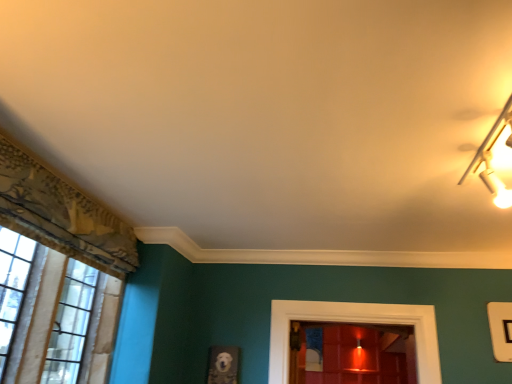
Question: From a real-world perspective, is white textured curtain at left physically located above or below metallic gold light fixture at upper right?

Choices:
 (A) above
 (B) below

Answer: (B)

Question: From the image's perspective, is white textured curtain at left located above or below metallic gold light fixture at upper right?

Choices:
 (A) above
 (B) below

Answer: (B)

Question: Looking at the image, does white textured curtain at left seem bigger or smaller compared to metallic gold light fixture at upper right?

Choices:
 (A) big
 (B) small

Answer: (A)

Question: Considering the positions of metallic gold light fixture at upper right and white textured curtain at left in the image, is metallic gold light fixture at upper right taller or shorter than white textured curtain at left?

Choices:
 (A) tall
 (B) short

Answer: (B)

Question: Is point (498, 200) closer or farther from the camera than point (24, 294)?

Choices:
 (A) closer
 (B) farther

Answer: (B)

Question: Relative to white textured curtain at left, is metallic gold light fixture at upper right in front or behind?

Choices:
 (A) front
 (B) behind

Answer: (A)

Question: Is metallic gold light fixture at upper right bigger or smaller than white textured curtain at left?

Choices:
 (A) big
 (B) small

Answer: (B)